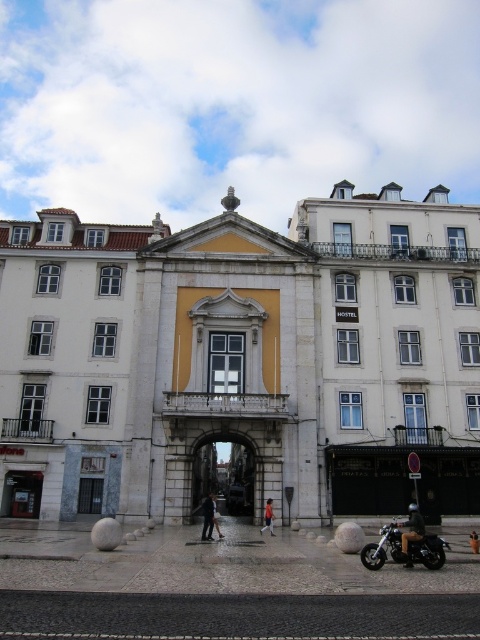
Question: Which of the following is the closest to the observer?

Choices:
 (A) (436, 548)
 (B) (204, 538)
 (C) (210, 442)
 (D) (411, 525)

Answer: (A)

Question: Where is leather jacket at lower right located in relation to dark gray fabric jacket at center in the image?

Choices:
 (A) right
 (B) left

Answer: (A)

Question: Is dark gray fabric jacket at center bigger than orange fabric jacket at center?

Choices:
 (A) no
 (B) yes

Answer: (B)

Question: Is shiny black motorcycle at lower right behind dark gray fabric jacket at center?

Choices:
 (A) yes
 (B) no

Answer: (B)

Question: Estimate the real-world distances between objects in this image. Which object is farther from the orange fabric jacket at center?

Choices:
 (A) dark gray fabric jacket at center
 (B) shiny black motorcycle at lower right
 (C) leather jacket at lower right

Answer: (B)

Question: Which object is the closest to the dark gray fabric jacket at center?

Choices:
 (A) leather jacket at lower right
 (B) shiny black motorcycle at lower right
 (C) dark gray stone archway at center

Answer: (C)